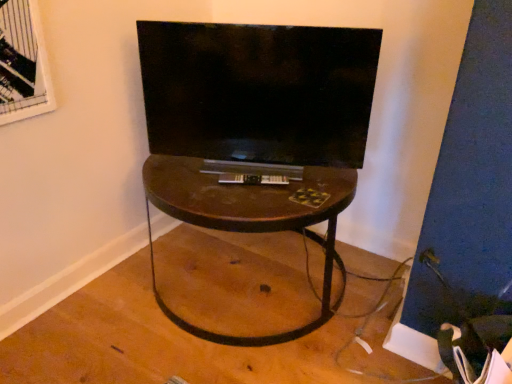
Question: Is matte black tv at center positioned behind velvet black swivel chair at lower right?

Choices:
 (A) no
 (B) yes

Answer: (B)

Question: Is matte black tv at center smaller than velvet black swivel chair at lower right?

Choices:
 (A) no
 (B) yes

Answer: (A)

Question: Can you confirm if matte black tv at center is taller than velvet black swivel chair at lower right?

Choices:
 (A) yes
 (B) no

Answer: (A)

Question: Does matte black tv at center turn towards velvet black swivel chair at lower right?

Choices:
 (A) no
 (B) yes

Answer: (A)

Question: Does matte black tv at center have a lesser height compared to velvet black swivel chair at lower right?

Choices:
 (A) yes
 (B) no

Answer: (B)

Question: From the image's perspective, relative to velvet black swivel chair at lower right, is matte black tv at center above or below?

Choices:
 (A) below
 (B) above

Answer: (B)

Question: From a real-world perspective, is matte black tv at center positioned above or below velvet black swivel chair at lower right?

Choices:
 (A) above
 (B) below

Answer: (A)

Question: Is matte black tv at center to the left or to the right of velvet black swivel chair at lower right in the image?

Choices:
 (A) right
 (B) left

Answer: (B)

Question: Considering the positions of matte black tv at center and velvet black swivel chair at lower right in the image, is matte black tv at center bigger or smaller than velvet black swivel chair at lower right?

Choices:
 (A) small
 (B) big

Answer: (B)

Question: Is velvet black swivel chair at lower right bigger or smaller than matte black tv at center?

Choices:
 (A) big
 (B) small

Answer: (B)

Question: Is point (504, 322) closer or farther from the camera than point (239, 74)?

Choices:
 (A) closer
 (B) farther

Answer: (A)

Question: From a real-world perspective, is velvet black swivel chair at lower right above or below matte black tv at center?

Choices:
 (A) above
 (B) below

Answer: (B)

Question: Looking at their shapes, would you say velvet black swivel chair at lower right is wider or thinner than matte black tv at center?

Choices:
 (A) thin
 (B) wide

Answer: (B)

Question: Is point (266, 167) positioned closer to the camera than point (234, 336)?

Choices:
 (A) farther
 (B) closer

Answer: (A)

Question: From a real-world perspective, is matte black tv at center above or below brown wood table at center?

Choices:
 (A) below
 (B) above

Answer: (B)